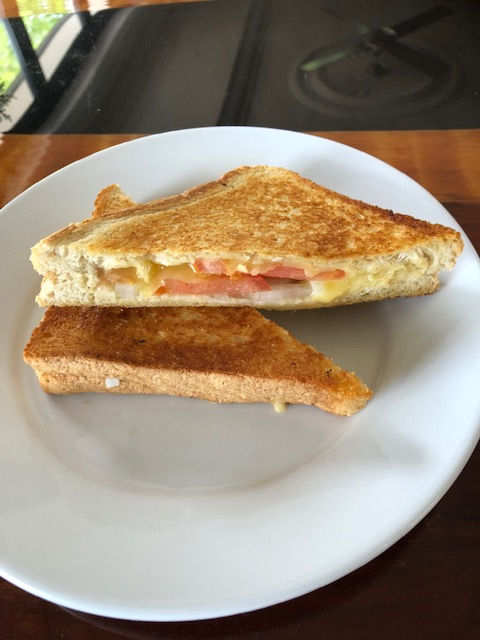
Identify the location of ceiling. This screenshot has height=640, width=480. (190, 79).